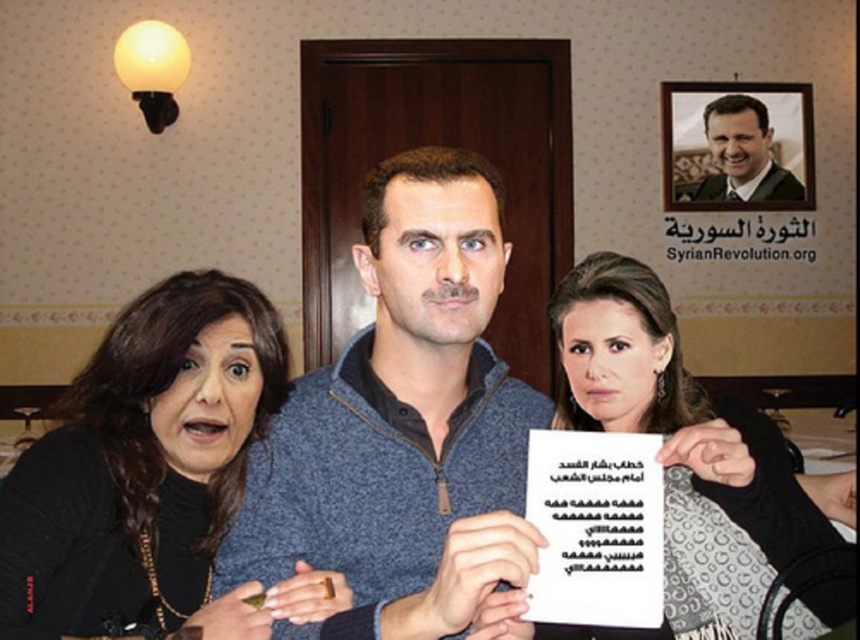
Question: Among these objects, which one is farthest from the camera?

Choices:
 (A) black matte hair at left
 (B) smooth black suit at upper right
 (C) blue knitted sweater at center

Answer: (B)

Question: Which object appears closest to the camera in this image?

Choices:
 (A) smooth black suit at upper right
 (B) black matte hair at left
 (C) matte black dress at center
 (D) blue knitted sweater at center

Answer: (D)

Question: Which point appears closest to the camera in this image?

Choices:
 (A) (17, 609)
 (B) (757, 160)
 (C) (708, 625)

Answer: (A)

Question: Is the position of black matte hair at left more distant than that of matte black dress at center?

Choices:
 (A) no
 (B) yes

Answer: (B)

Question: Is blue knitted sweater at center below matte black dress at center?

Choices:
 (A) no
 (B) yes

Answer: (A)

Question: Is matte black dress at center to the left of smooth black suit at upper right from the viewer's perspective?

Choices:
 (A) yes
 (B) no

Answer: (A)